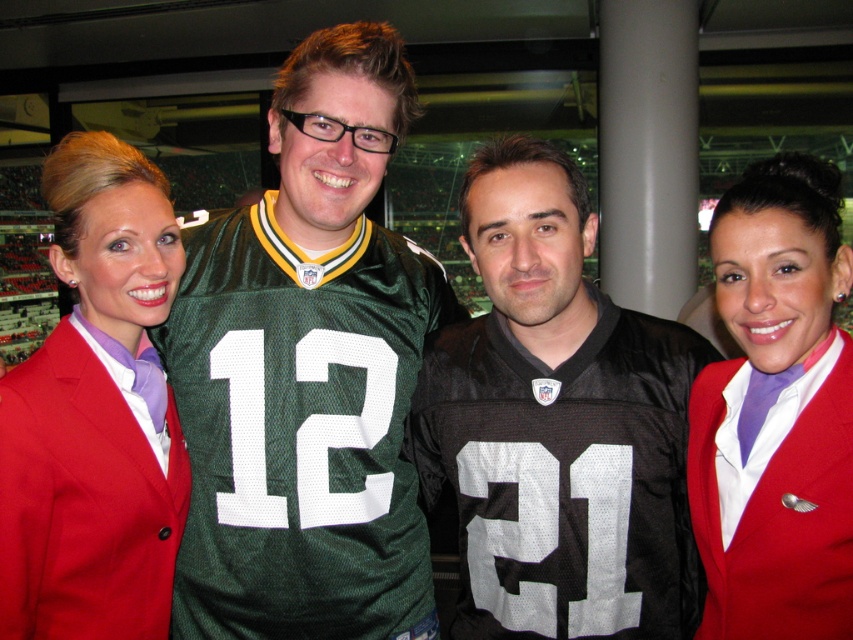
Question: Is black jersey at center positioned at the back of matte red blazer at center?

Choices:
 (A) yes
 (B) no

Answer: (A)

Question: Can you confirm if black jersey at center is bigger than matte red blazer at left?

Choices:
 (A) no
 (B) yes

Answer: (B)

Question: Which of the following is the farthest from the observer?

Choices:
 (A) (772, 272)
 (B) (155, 388)
 (C) (259, 608)
 (D) (566, 173)

Answer: (B)

Question: Which of the following is the closest to the observer?

Choices:
 (A) black jersey at center
 (B) matte red blazer at left

Answer: (B)

Question: Which object appears closest to the camera in this image?

Choices:
 (A) matte red blazer at center
 (B) green jersey at center
 (C) black jersey at center
 (D) matte red blazer at left

Answer: (A)

Question: Can you confirm if green jersey at center is positioned below matte red blazer at center?

Choices:
 (A) no
 (B) yes

Answer: (A)